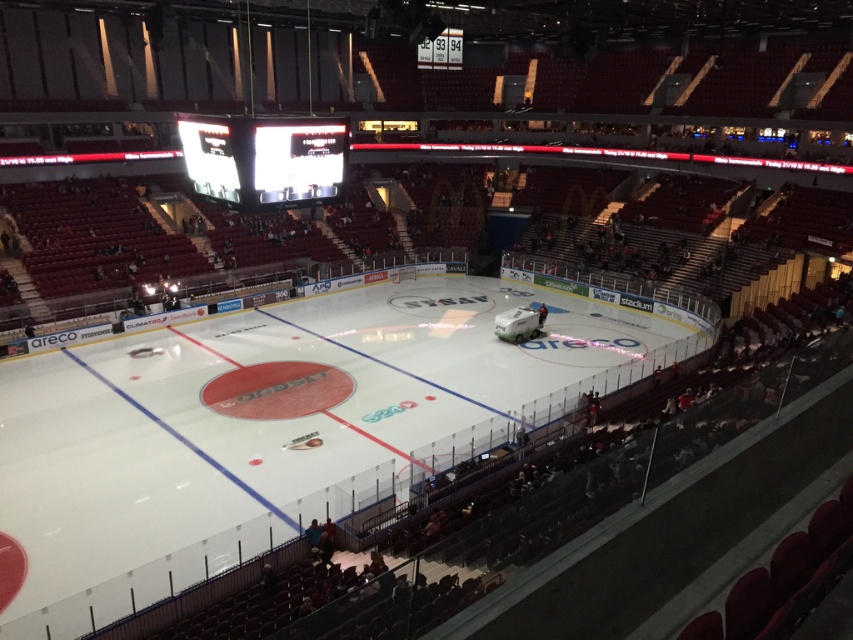
Based on the photo, you are an arena worker checking the arena layout. You need to determine the relative positions of the white smooth ice at center and the white glossy scoreboard at upper center. Which object is higher in the image?

The white smooth ice at center is taller than the white glossy scoreboard at upper center.

You are a spectator at the arena and want to find the white glossy scoreboard at upper center. Where should you look relative to the white smooth ice at center?

The white glossy scoreboard at upper center is positioned above the white smooth ice at center, so look upward from the ice to locate it.

You are standing at the point marked as point (283, 426) in the arena. What is the surface you are currently standing on?

The surface at point (283, 426) is white smooth ice at center.